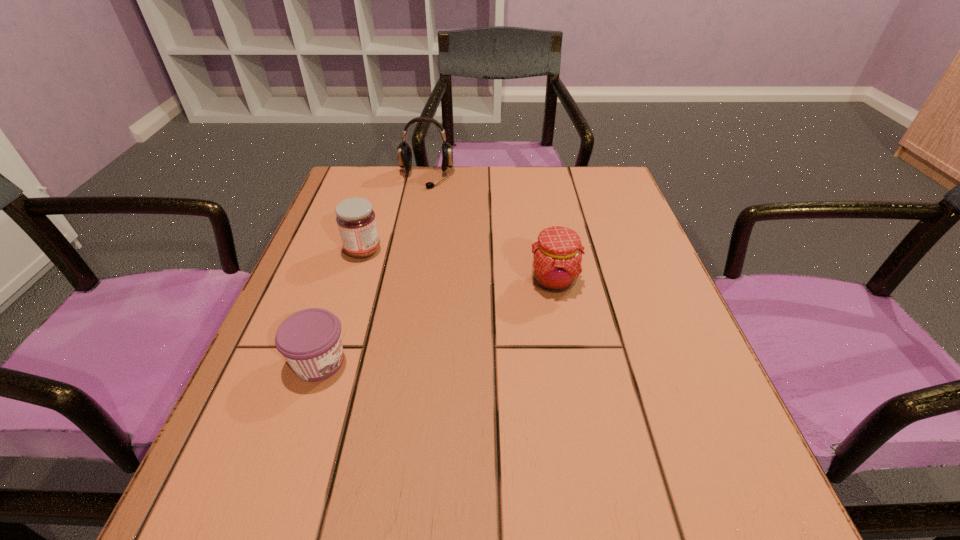
Where is `vacant area situated 0.360m on the front label of the nearest jam`? The image size is (960, 540). vacant area situated 0.360m on the front label of the nearest jam is located at coordinates click(565, 362).

Find the location of a particular element. The image size is (960, 540). object situated at the far edge is located at coordinates (404, 151).

You are a GUI agent. You are given a task and a screenshot of the screen. Output one action in this format:
    pyautogui.click(x=<x>, y=<y>)
    Task: Click on the headset that is positioned at the left edge
    The image size is (960, 540).
    Given the screenshot: What is the action you would take?
    pyautogui.click(x=404, y=151)

Find the location of a particular element. object situated at the far left corner is located at coordinates (404, 151).

Find the location of `vacant space at the far edge`. vacant space at the far edge is located at coordinates (534, 194).

This screenshot has height=540, width=960. In the image, there is a desktop. Find the location of `blank space at the near edge`. blank space at the near edge is located at coordinates (396, 502).

The height and width of the screenshot is (540, 960). Identify the location of vacant area at the left edge. (315, 397).

The height and width of the screenshot is (540, 960). What are the coordinates of `free location at the right edge of the desktop` in the screenshot? It's located at (641, 258).

Image resolution: width=960 pixels, height=540 pixels. In order to click on vacant area at the far left corner of the desktop in this screenshot , I will do `click(338, 182)`.

In the image, there is a desktop. Find the location of `vacant space at the near left corner`. vacant space at the near left corner is located at coordinates (216, 535).